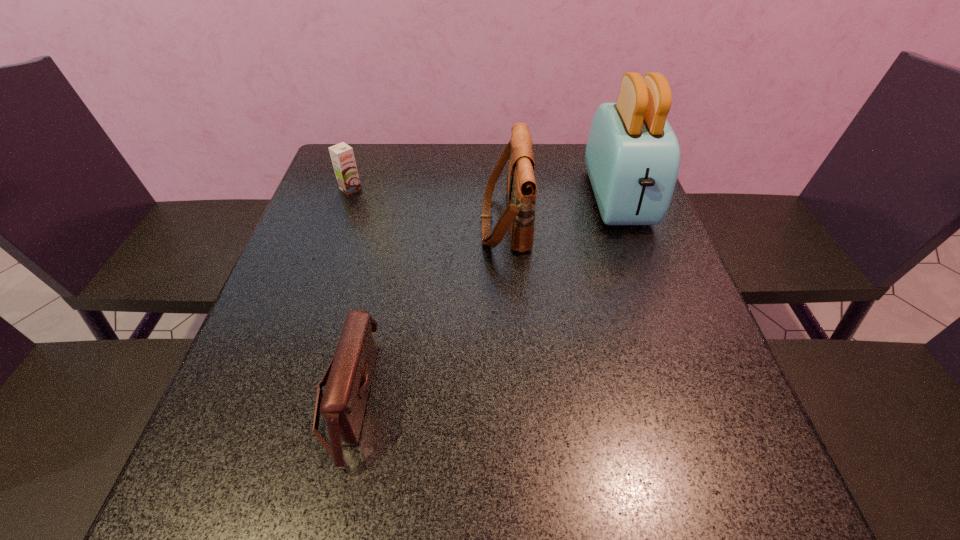
Locate an element on the screen. toaster is located at coordinates (632, 157).

I want to click on the tallest object, so click(632, 157).

This screenshot has height=540, width=960. In order to click on the right shoulder bag in this screenshot , I will do `click(521, 188)`.

You are a GUI agent. You are given a task and a screenshot of the screen. Output one action in this format:
    pyautogui.click(x=<x>, y=<y>)
    Task: Click on the taller shoulder bag
    Image resolution: width=960 pixels, height=540 pixels.
    Given the screenshot: What is the action you would take?
    pyautogui.click(x=521, y=188)

Locate an element on the screen. The image size is (960, 540). chocolate milk is located at coordinates (342, 156).

The width and height of the screenshot is (960, 540). In order to click on the left shoulder bag in this screenshot , I will do click(x=348, y=376).

Locate an element on the screen. the nearest object is located at coordinates (348, 376).

You are a GUI agent. You are given a task and a screenshot of the screen. Output one action in this format:
    pyautogui.click(x=<x>, y=<y>)
    Task: Click on the vacant space located on the side of the rightmost object with the lever
    This screenshot has height=540, width=960.
    Given the screenshot: What is the action you would take?
    pyautogui.click(x=661, y=316)

The width and height of the screenshot is (960, 540). I want to click on vacant space positioned 0.160m on the front-facing side of the taller shoulder bag, so click(x=418, y=220).

Where is `vacant area situated on the front-facing side of the taller shoulder bag`? vacant area situated on the front-facing side of the taller shoulder bag is located at coordinates (433, 220).